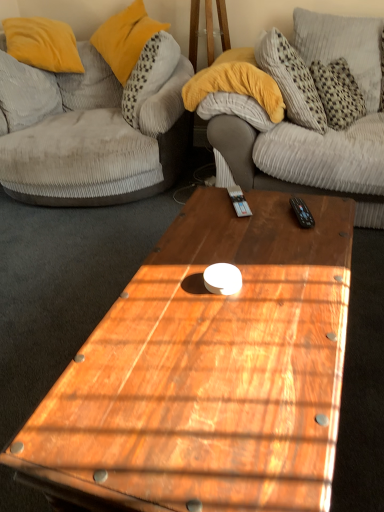
Measure the distance between point (369, 93) and camera.

The distance of point (369, 93) from camera is 2.34 meters.

What do you see at coordinates (302, 212) in the screenshot?
I see `black plastic remote control at upper right` at bounding box center [302, 212].

Describe the element at coordinates (209, 370) in the screenshot. I see `wooden coffee table at center` at that location.

You are a GUI agent. You are given a task and a screenshot of the screen. Output one action in this format:
    pyautogui.click(x=<x>, y=<y>)
    Task: Click on the velvet grey couch at left
    This screenshot has width=384, height=512.
    Given the screenshot: What is the action you would take?
    pyautogui.click(x=96, y=142)

Between gray corduroy pillow at upper left, which is counted as the third pillow, starting from the right, and wooden coffee table at center, which one has smaller width?

gray corduroy pillow at upper left, which is counted as the third pillow, starting from the right, is thinner.

Can you confirm if gray corduroy pillow at upper left, which is counted as the third pillow, starting from the right, is shorter than wooden coffee table at center?

In fact, gray corduroy pillow at upper left, which is counted as the third pillow, starting from the right, may be taller than wooden coffee table at center.

From the image's perspective, is gray corduroy pillow at upper left, acting as the 1th pillow starting from the left, over wooden coffee table at center?

Yes, from the image's perspective, gray corduroy pillow at upper left, acting as the 1th pillow starting from the left, is over wooden coffee table at center.

The width and height of the screenshot is (384, 512). In order to click on coffee table in front of the gray corduroy pillow at upper left, acting as the 1th pillow starting from the left in this screenshot , I will do `click(209, 370)`.

From the image's perspective, which object appears higher, gray corduroy pillow at upper right, the 1th pillow when ordered from right to left, or wooden coffee table at center?

gray corduroy pillow at upper right, the 1th pillow when ordered from right to left, is shown above in the image.

Is gray corduroy pillow at upper right, the 1th pillow when ordered from right to left, to the right of wooden coffee table at center from the viewer's perspective?

Correct, you'll find gray corduroy pillow at upper right, the 1th pillow when ordered from right to left, to the right of wooden coffee table at center.

Can you confirm if gray corduroy pillow at upper right, positioned as the 3th pillow in left-to-right order, is bigger than wooden coffee table at center?

Actually, gray corduroy pillow at upper right, positioned as the 3th pillow in left-to-right order, might be smaller than wooden coffee table at center.

From a real-world perspective, which is physically above, yellow velvet pillow at upper left, the 2th pillow when ordered from right to left, or gray corduroy pillow at upper right, the 1th pillow when ordered from right to left?

yellow velvet pillow at upper left, the 2th pillow when ordered from right to left.

From the image's perspective, between yellow velvet pillow at upper left, placed as the 2th pillow when sorted from left to right, and gray corduroy pillow at upper right, positioned as the 3th pillow in left-to-right order, who is located below?

gray corduroy pillow at upper right, positioned as the 3th pillow in left-to-right order, appears lower in the image.

Which of these two, yellow velvet pillow at upper left, placed as the 2th pillow when sorted from left to right, or gray corduroy pillow at upper right, the 1th pillow when ordered from right to left, is wider?

Wider between the two is yellow velvet pillow at upper left, placed as the 2th pillow when sorted from left to right.

From a real-world perspective, is velvet grey couch at left under wooden coffee table at center?

No, from a real-world perspective, velvet grey couch at left is not under wooden coffee table at center.

From the image's perspective, is velvet grey couch at left under wooden coffee table at center?

Actually, velvet grey couch at left appears above wooden coffee table at center in the image.

Visually, is velvet grey couch at left positioned to the left or to the right of wooden coffee table at center?

In the image, velvet grey couch at left appears on the left side of wooden coffee table at center.

Is wooden coffee table at center completely or partially inside velvet grey couch at left?

That's incorrect, wooden coffee table at center is not inside velvet grey couch at left.

Considering the sizes of objects black plastic remote control at upper right and wooden coffee table at center in the image provided, who is wider, black plastic remote control at upper right or wooden coffee table at center?

Wider between the two is wooden coffee table at center.

Can you confirm if black plastic remote control at upper right is bigger than wooden coffee table at center?

No.

Is black plastic remote control at upper right in front of or behind wooden coffee table at center in the image?

Clearly, black plastic remote control at upper right is behind wooden coffee table at center.

From a real-world perspective, is black plastic remote control at upper right above or below wooden coffee table at center?

Clearly, from a real-world perspective, black plastic remote control at upper right is above wooden coffee table at center.

Which is correct: wooden coffee table at center is inside black plastic remote control at upper right, or outside of it?

wooden coffee table at center is not enclosed by black plastic remote control at upper right.

Can you confirm if wooden coffee table at center is smaller than black plastic remote control at upper right?

Incorrect, wooden coffee table at center is not smaller in size than black plastic remote control at upper right.

Considering the relative positions of wooden coffee table at center and black plastic remote control at upper right in the image provided, is wooden coffee table at center behind black plastic remote control at upper right?

No, wooden coffee table at center is in front of black plastic remote control at upper right.

Is wooden coffee table at center to the right of black plastic remote control at upper right from the viewer's perspective?

In fact, wooden coffee table at center is to the left of black plastic remote control at upper right.

Looking at this image, is yellow velvet pillow at upper left, placed as the 2th pillow when sorted from left to right, far away from wooden coffee table at center?

Yes, yellow velvet pillow at upper left, placed as the 2th pillow when sorted from left to right, is far from wooden coffee table at center.

Is yellow velvet pillow at upper left, placed as the 2th pillow when sorted from left to right, completely or partially outside of wooden coffee table at center?

Absolutely, yellow velvet pillow at upper left, placed as the 2th pillow when sorted from left to right, is external to wooden coffee table at center.

Would you say yellow velvet pillow at upper left, placed as the 2th pillow when sorted from left to right, is to the left or to the right of wooden coffee table at center in the picture?

Based on their positions, yellow velvet pillow at upper left, placed as the 2th pillow when sorted from left to right, is located to the left of wooden coffee table at center.

From a real-world perspective, between yellow velvet pillow at upper left, the 2th pillow when ordered from right to left, and wooden coffee table at center, who is vertically lower?

wooden coffee table at center.

Which pillow is the 2nd one when counting from the back of the wooden coffee table at center? Please provide its 2D coordinates.

[(26, 94)]

Find the location of `pillow that is on the right side of wooden coffee table at center`. pillow that is on the right side of wooden coffee table at center is located at coordinates (343, 47).

Estimate the real-world distances between objects in this image. Which object is further from gray corduroy pillow at upper left, acting as the 1th pillow starting from the left, black plastic remote control at upper right or wooden coffee table at center?

The object further to gray corduroy pillow at upper left, acting as the 1th pillow starting from the left, is black plastic remote control at upper right.

When comparing their distances from gray corduroy pillow at upper left, acting as the 1th pillow starting from the left, does gray corduroy pillow at upper right, positioned as the 3th pillow in left-to-right order, or yellow velvet pillow at upper left, placed as the 2th pillow when sorted from left to right, seem closer?

Among the two, yellow velvet pillow at upper left, placed as the 2th pillow when sorted from left to right, is located nearer to gray corduroy pillow at upper left, acting as the 1th pillow starting from the left.

Which object lies nearer to the anchor point yellow velvet pillow at upper left, the 2th pillow when ordered from right to left, velvet grey couch at left or gray corduroy pillow at upper left, acting as the 1th pillow starting from the left?

velvet grey couch at left is closer to yellow velvet pillow at upper left, the 2th pillow when ordered from right to left.

In the scene shown: When comparing their distances from gray corduroy pillow at upper right, positioned as the 3th pillow in left-to-right order, does velvet grey couch at left or black plastic remote control at upper right seem closer?

velvet grey couch at left is closer to gray corduroy pillow at upper right, positioned as the 3th pillow in left-to-right order.

Which object lies nearer to the anchor point gray corduroy pillow at upper left, which is counted as the third pillow, starting from the right, velvet grey couch at left or black plastic remote control at upper right?

Based on the image, velvet grey couch at left appears to be nearer to gray corduroy pillow at upper left, which is counted as the third pillow, starting from the right.

When comparing their distances from gray corduroy pillow at upper left, which is counted as the third pillow, starting from the right, does velvet grey couch at left or wooden coffee table at center seem closer?

The object closer to gray corduroy pillow at upper left, which is counted as the third pillow, starting from the right, is velvet grey couch at left.

Looking at the image, which one is located closer to velvet grey couch at left, black plastic remote control at upper right or wooden coffee table at center?

wooden coffee table at center lies closer to velvet grey couch at left than the other object.

Considering their positions, is wooden coffee table at center positioned further to velvet grey couch at left than yellow velvet pillow at upper left, placed as the 2th pillow when sorted from left to right?

wooden coffee table at center lies further to velvet grey couch at left than the other object.

Where is `studio couch situated between gray corduroy pillow at upper left, acting as the 1th pillow starting from the left, and black plastic remote control at upper right from left to right`? The height and width of the screenshot is (512, 384). studio couch situated between gray corduroy pillow at upper left, acting as the 1th pillow starting from the left, and black plastic remote control at upper right from left to right is located at coordinates (96, 142).

This screenshot has height=512, width=384. Find the location of `pillow located between velvet grey couch at left and gray corduroy pillow at upper right, the 1th pillow when ordered from right to left, in the left-right direction`. pillow located between velvet grey couch at left and gray corduroy pillow at upper right, the 1th pillow when ordered from right to left, in the left-right direction is located at coordinates (125, 38).

This screenshot has width=384, height=512. In order to click on studio couch located between gray corduroy pillow at upper left, which is counted as the third pillow, starting from the right, and yellow velvet pillow at upper left, the 2th pillow when ordered from right to left, in the left-right direction in this screenshot , I will do `click(96, 142)`.

Find the location of a particular element. Image resolution: width=384 pixels, height=512 pixels. studio couch between yellow velvet pillow at upper left, placed as the 2th pillow when sorted from left to right, and black plastic remote control at upper right in the up-down direction is located at coordinates (96, 142).